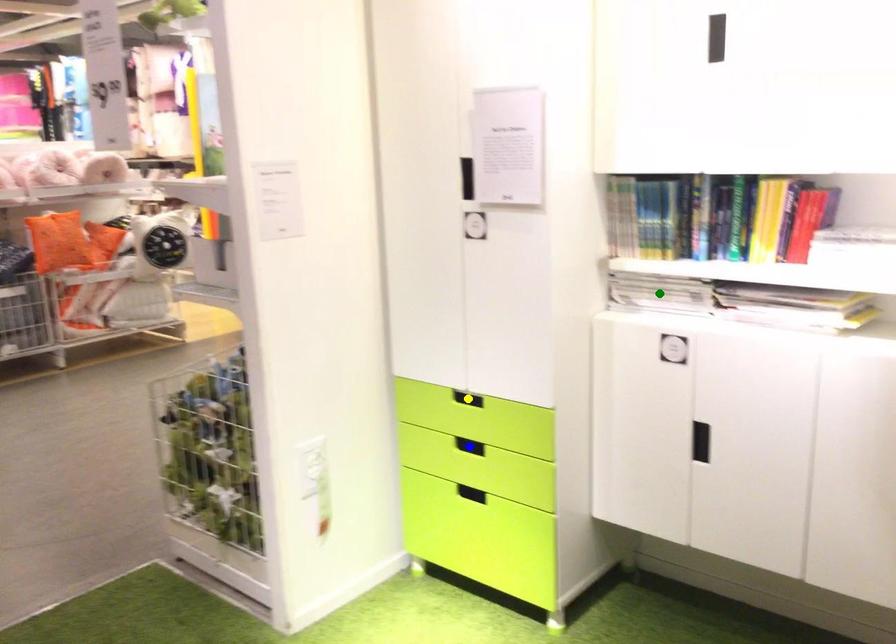
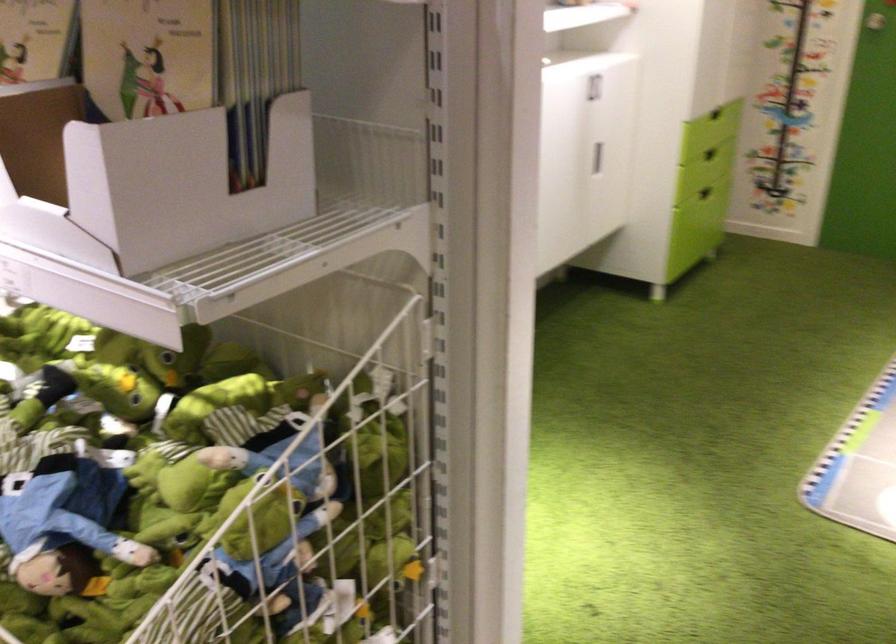
I am providing you with two images of the same scene from different viewpoints. Three points are marked in image1. Which point corresponds to a part or object that is occluded in image2?In image1, three points are marked. Which of them correspond to a part or object that is occluded in image2?Among the three points shown in image1, which one corresponds to a part or object that is no longer visible due to occlusion in image2?

Invisible in image2: green point, blue point, yellow point.